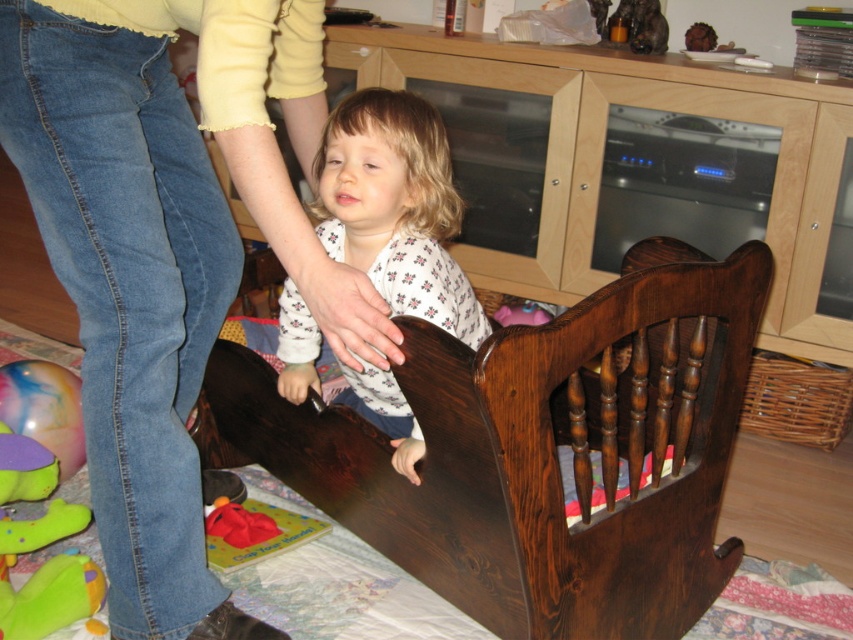
You are a photographer setting up a shoot in this room. You need to place a small tripod between the denim jeans at lower left and the soft plush toy at lower left. Which object should the tripod be closer to in order to be positioned between them?

The tripod should be closer to the denim jeans at lower left because it is nearer to the viewer than the soft plush toy at lower left, so placing the tripod between them would require it to be closer to the denim jeans.

In the scene shown: You are a photographer setting up for a family photo. The scene requires the dark brown wood infant bed at center to be visible behind the white floral pajamas at center. Based on their current positions, is this possible?

The dark brown wood infant bed at center is positioned under the white floral pajamas at center, so it is possible to see the bed behind the pajamas as they are arranged in a layered position.

Looking at this image, you are a photographer setting up a camera at point 0.5, 0.5. You want to take a photo of the dark brown wood infant bed at center. Is the infant bed within the camera frame?

The dark brown wood infant bed at center is located at point (537, 451), which is outside the camera frame centered at (426, 320). The bed is to the right and slightly above the camera center, so it might be partially visible but not fully centered in the frame.